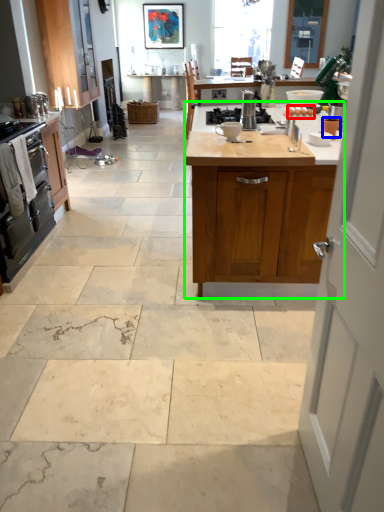
Question: Based on their relative distances, which object is nearer to food (highlighted by a red box)? Choose from appliance (highlighted by a blue box) and cabinetry (highlighted by a green box).

Choices:
 (A) appliance
 (B) cabinetry

Answer: (A)